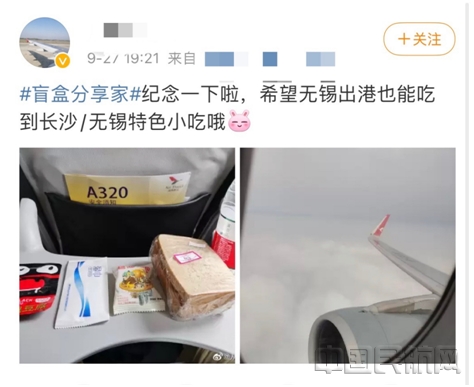
Where is `hand wipe`? This screenshot has width=474, height=387. hand wipe is located at coordinates (78, 297).